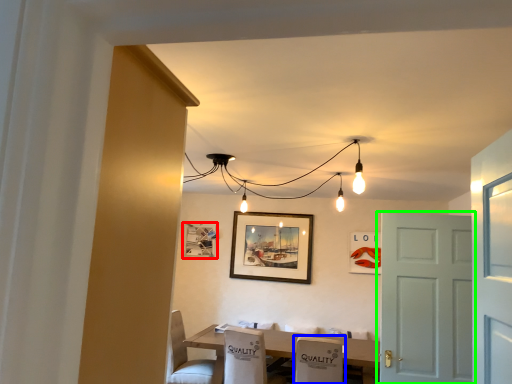
Question: Which object is positioned closest to picture frame (highlighted by a red box)? Select from armchair (highlighted by a blue box) and door (highlighted by a green box).

Choices:
 (A) armchair
 (B) door

Answer: (A)